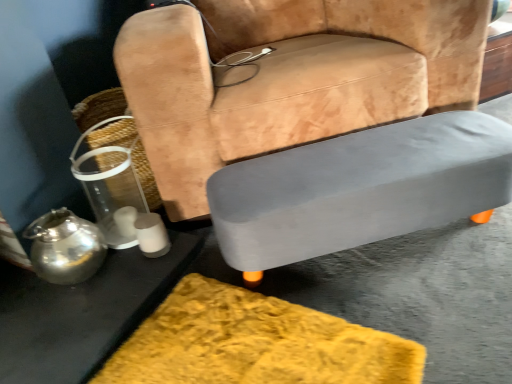
I want to click on vacant space in front of gray matte table at lower right, the 1th table when ordered from right to left, so click(x=413, y=310).